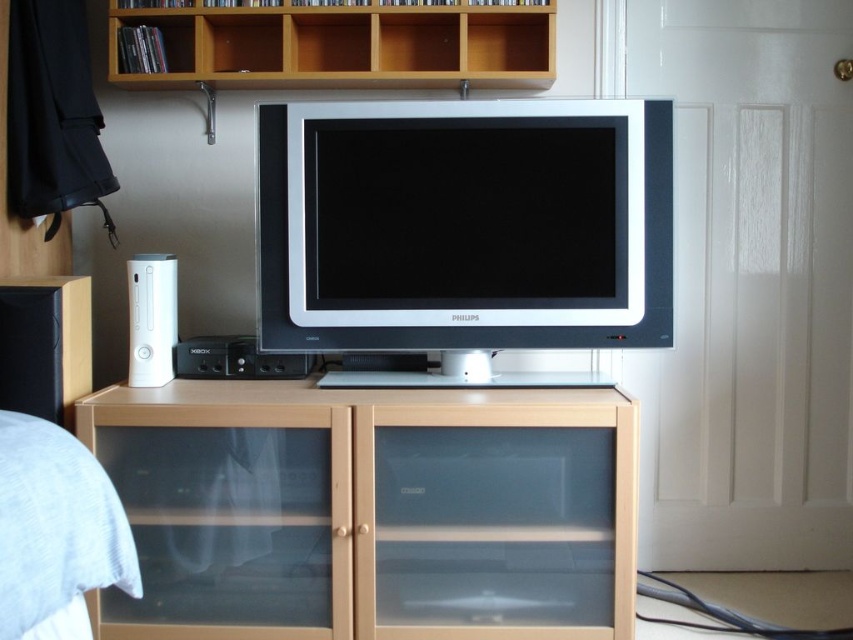
Is light brown wood cabinet at center wider than satin silver flat screen tv at center?

Yes.

Find the location of a particular element. This screenshot has width=853, height=640. light brown wood cabinet at center is located at coordinates (373, 512).

The height and width of the screenshot is (640, 853). I want to click on light brown wood cabinet at center, so click(373, 512).

Can you confirm if satin silver flat screen tv at center is bigger than light brown wood at upper center?

No, satin silver flat screen tv at center is not bigger than light brown wood at upper center.

Does satin silver flat screen tv at center appear on the right side of light brown wood at upper center?

Yes, satin silver flat screen tv at center is to the right of light brown wood at upper center.

The image size is (853, 640). Describe the element at coordinates (463, 225) in the screenshot. I see `satin silver flat screen tv at center` at that location.

Image resolution: width=853 pixels, height=640 pixels. I want to click on satin silver flat screen tv at center, so click(463, 225).

Can you confirm if light brown wood cabinet at center is positioned below light brown wood at upper center?

Yes, light brown wood cabinet at center is below light brown wood at upper center.

Does light brown wood cabinet at center have a lesser width compared to light brown wood at upper center?

Incorrect, light brown wood cabinet at center's width is not less than light brown wood at upper center's.

You are a GUI agent. You are given a task and a screenshot of the screen. Output one action in this format:
    pyautogui.click(x=<x>, y=<y>)
    Task: Click on the light brown wood cabinet at center
    
    Given the screenshot: What is the action you would take?
    pyautogui.click(x=373, y=512)